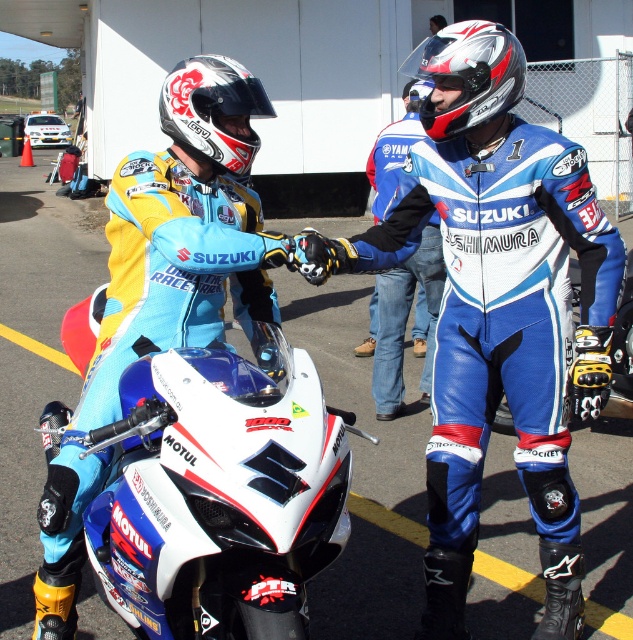
You are a photographer at the event and want to capture a photo where both the blue leather suit at center and the white glossy helmet at upper center are clearly visible. Based on their sizes, which object will appear larger in the photo?

The blue leather suit at center will appear larger in the photo because it is much taller than the white glossy helmet at upper center.

What color is the suit at the point with coordinates (192,400)?

The suit at the point with coordinates (192,400) is matte blue.